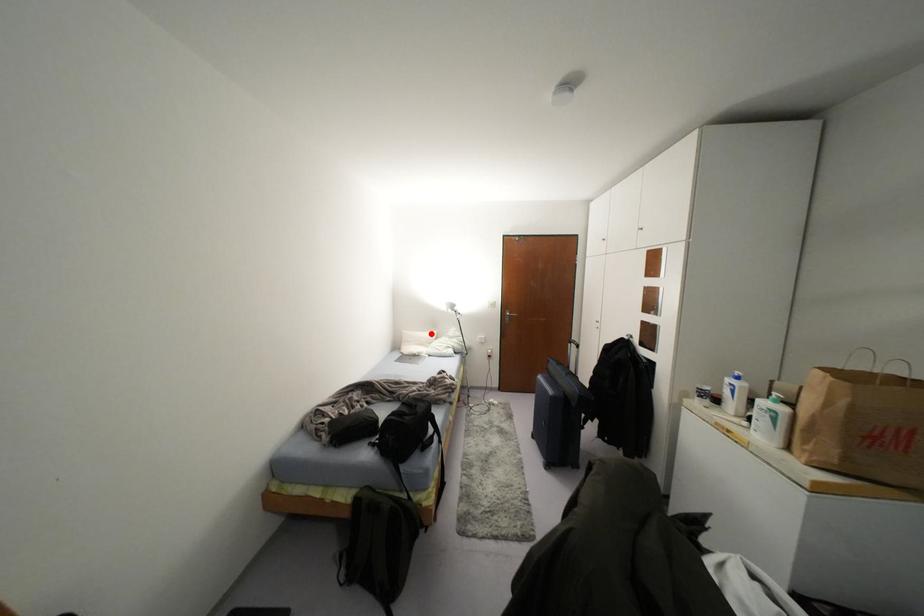
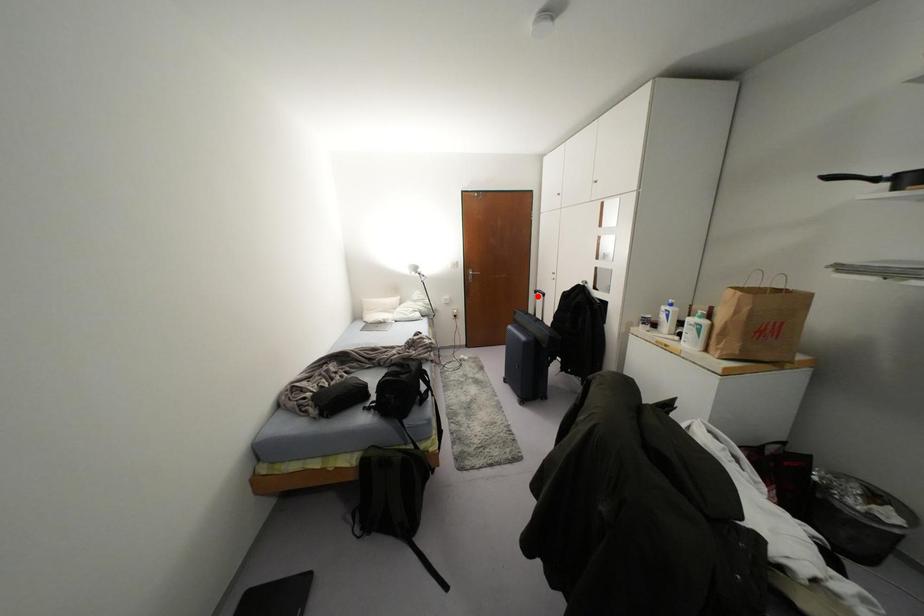
I am providing you with two images of the same scene from different viewpoints. A red point is marked on the first image and another point is marked on the second image. Does the point marked in image1 correspond to the same location as the one in image2?

No